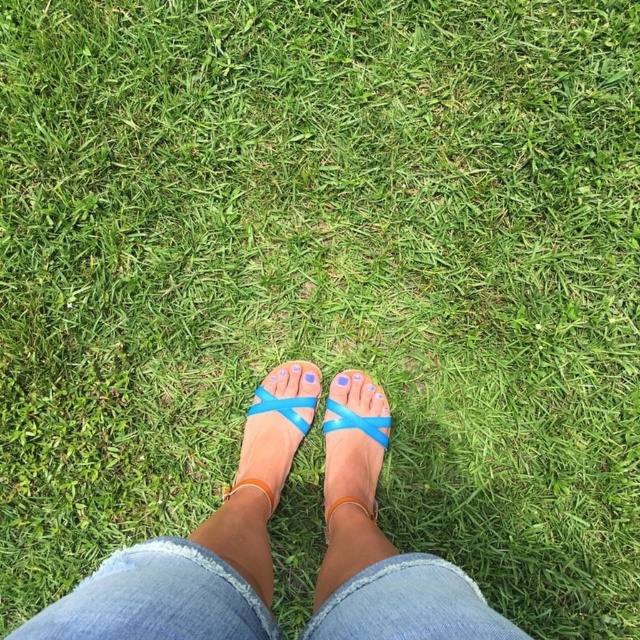
Question: Considering the real-world distances, which object is farthest from the blue matte toe at center?

Choices:
 (A) translucent plastic sandal at center
 (B) denim at center
 (C) translucent blue sandal at center

Answer: (B)

Question: Which point is farther to the camera?

Choices:
 (A) (362, 577)
 (B) (246, 472)

Answer: (B)

Question: Does denim at center have a lesser width compared to translucent plastic sandal at center?

Choices:
 (A) no
 (B) yes

Answer: (A)

Question: Is translucent plastic sandals at center smaller than denim at center?

Choices:
 (A) yes
 (B) no

Answer: (B)

Question: Among these objects, which one is farthest from the camera?

Choices:
 (A) translucent plastic sandals at center
 (B) translucent plastic sandal at center
 (C) translucent blue sandal at center

Answer: (C)

Question: Is translucent plastic sandals at center to the left of translucent plastic sandal at center from the viewer's perspective?

Choices:
 (A) no
 (B) yes

Answer: (B)